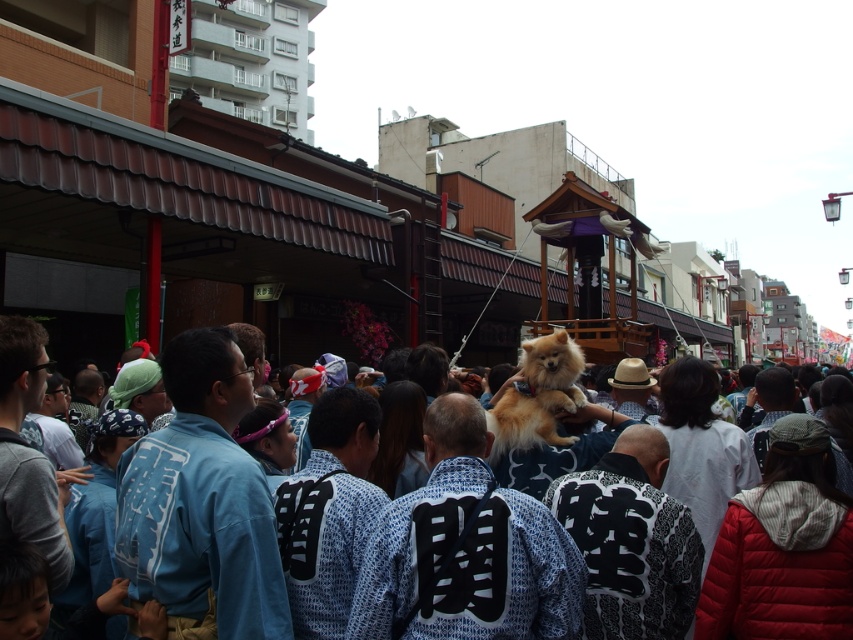
Question: Considering the relative positions of fluffy brown dog at center and golden fur dog at center in the image provided, where is fluffy brown dog at center located with respect to golden fur dog at center?

Choices:
 (A) left
 (B) right

Answer: (A)

Question: Among these points, which one is nearest to the camera?

Choices:
 (A) (149, 627)
 (B) (573, 356)

Answer: (A)

Question: Where is fluffy brown dog at center located in relation to golden fur dog at center in the image?

Choices:
 (A) below
 (B) above

Answer: (A)

Question: Does fluffy brown dog at center appear under golden fur dog at center?

Choices:
 (A) yes
 (B) no

Answer: (A)